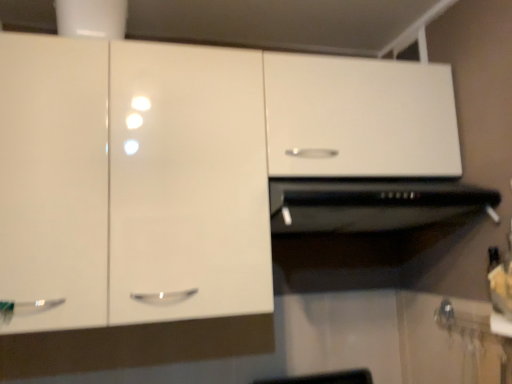
Question: Considering the positions of black matte vent at center and white glossy cabinet at upper center in the image, is black matte vent at center wider or thinner than white glossy cabinet at upper center?

Choices:
 (A) wide
 (B) thin

Answer: (A)

Question: Considering the positions of point (352, 231) and point (239, 147), is point (352, 231) closer or farther from the camera than point (239, 147)?

Choices:
 (A) closer
 (B) farther

Answer: (B)

Question: Is black matte vent at center inside the boundaries of white glossy cabinet at upper center, or outside?

Choices:
 (A) outside
 (B) inside

Answer: (B)

Question: Is white glossy cabinet at upper center situated inside black matte vent at center or outside?

Choices:
 (A) inside
 (B) outside

Answer: (B)

Question: From a real-world perspective, relative to black matte vent at center, is white glossy cabinet at upper center vertically above or below?

Choices:
 (A) below
 (B) above

Answer: (B)

Question: Does point (14, 226) appear closer or farther from the camera than point (355, 190)?

Choices:
 (A) closer
 (B) farther

Answer: (A)

Question: Would you say white glossy cabinet at upper center is to the left or to the right of black matte vent at center in the picture?

Choices:
 (A) right
 (B) left

Answer: (B)